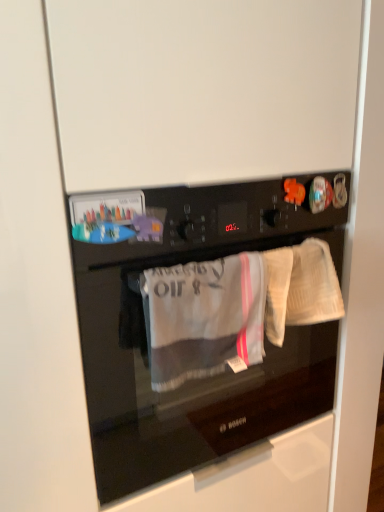
Question: Is white textured towel at right spatially inside black glass oven at center, or outside of it?

Choices:
 (A) inside
 (B) outside

Answer: (A)

Question: Is point (292, 253) closer or farther from the camera than point (129, 245)?

Choices:
 (A) closer
 (B) farther

Answer: (B)

Question: Which is nearer to the black glass oven at center?

Choices:
 (A) white textured towel at right
 (B) gray cotton towel at center

Answer: (B)

Question: Estimate the real-world distances between objects in this image. Which object is farther from the white textured towel at right?

Choices:
 (A) gray cotton towel at center
 (B) black glass oven at center

Answer: (B)